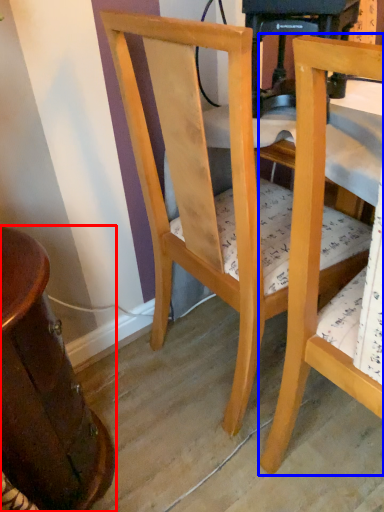
Question: Which of the following is the closest to the observer, table (highlighted by a red box) or chair (highlighted by a blue box)?

Choices:
 (A) table
 (B) chair

Answer: (B)